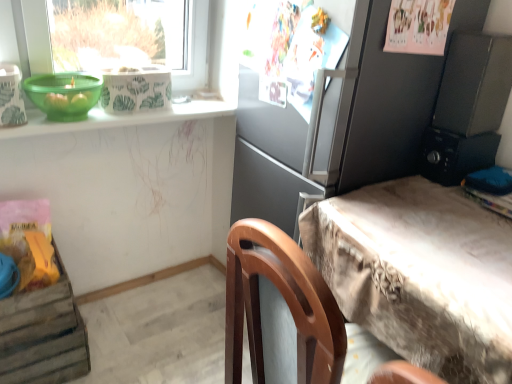
Where is `vacant space positioned to the left of black plastic radio at upper right`? The width and height of the screenshot is (512, 384). vacant space positioned to the left of black plastic radio at upper right is located at coordinates (409, 184).